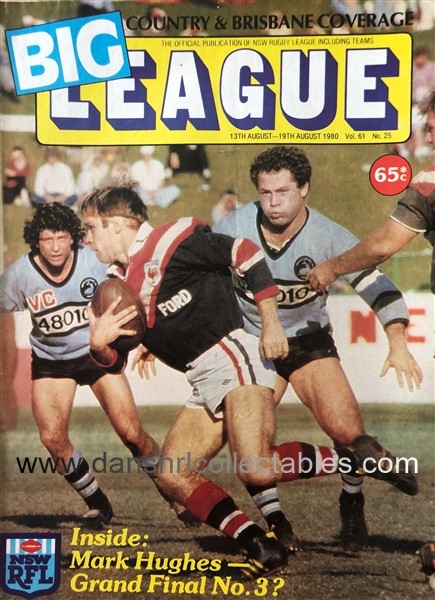
The height and width of the screenshot is (600, 435). I want to click on stands, so click(327, 181).